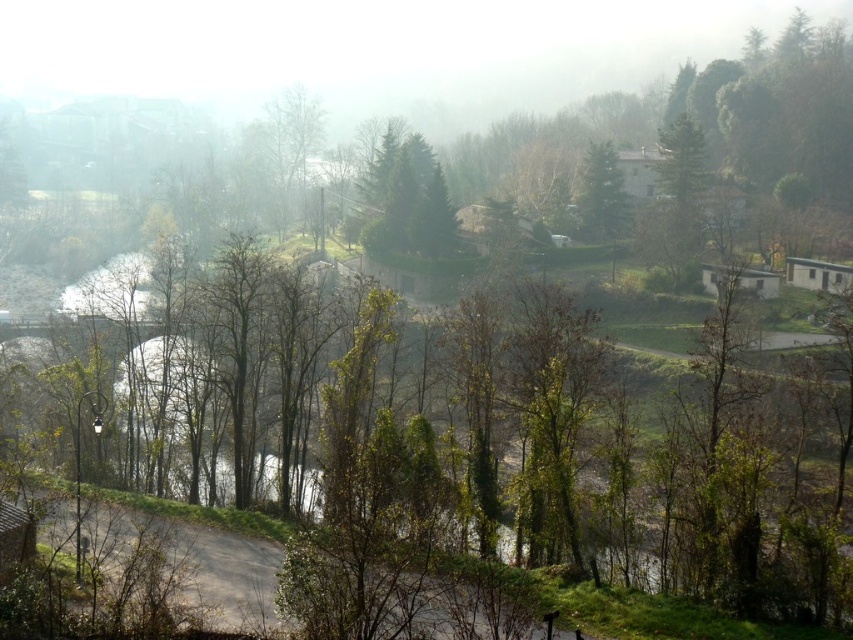
Question: Which of the following is the farthest from the observer?

Choices:
 (A) green textured tree at center
 (B) green matte tree at upper center

Answer: (B)

Question: Is green textured tree at center closer to camera compared to green matte tree at upper center?

Choices:
 (A) no
 (B) yes

Answer: (B)

Question: Does green textured tree at center have a lesser width compared to green matte tree at upper center?

Choices:
 (A) no
 (B) yes

Answer: (A)

Question: Which point is farther to the camera?

Choices:
 (A) green textured tree at center
 (B) green matte tree at upper center

Answer: (B)

Question: Which point is closer to the camera?

Choices:
 (A) (585, 186)
 (B) (409, 211)

Answer: (B)

Question: Can you confirm if green textured tree at center is positioned to the left of green matte tree at upper center?

Choices:
 (A) no
 (B) yes

Answer: (B)